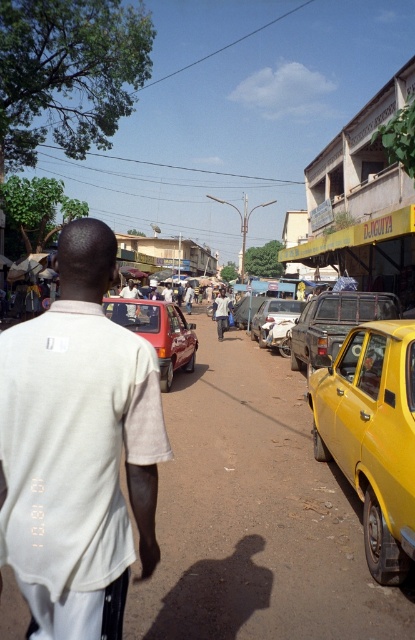
You are an observer standing on the sidewalk. You see a person wearing a white cotton shirt at center and a metallic silver car at center. Which object is wider?

The white cotton shirt at center is wider than the metallic silver car at center.

You are a delivery driver who needs to park your vehicle between the matte red car at center and the rusty metal car at center. Given that your vehicle is 4 meters long, can you fit it there?

The matte red car at center is smaller than the rusty metal car at center, but the distance between them isn not specified. Without knowing the space between the two cars, it is impossible to determine if your vehicle can fit.